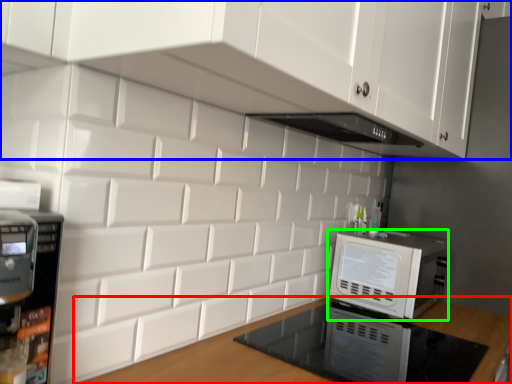
Question: Estimate the real-world distances between objects in this image. Which object is farther from countertop (highlighted by a red box), cabinetry (highlighted by a blue box) or home appliance (highlighted by a green box)?

Choices:
 (A) cabinetry
 (B) home appliance

Answer: (A)